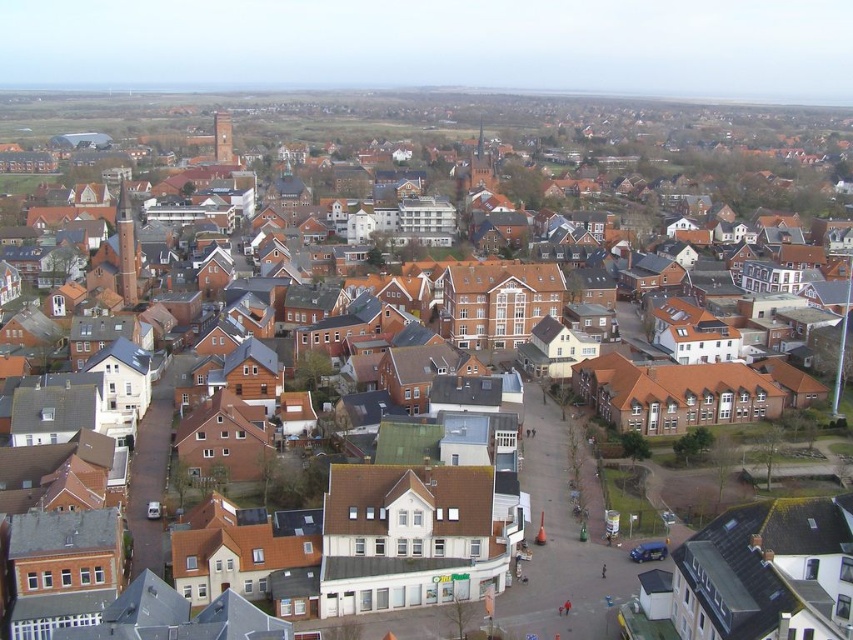
You are standing at the center of the town and want to reach a specific location. You have two options to choose from, represented by point coordinates. Which point, point (x=120, y=285) or point (x=221, y=152), is closer to your current position?

Point (x=120, y=285) is closer to the viewer than point (x=221, y=152), so you should choose point (x=120, y=285) as it is nearer to your current position at the center of the town.